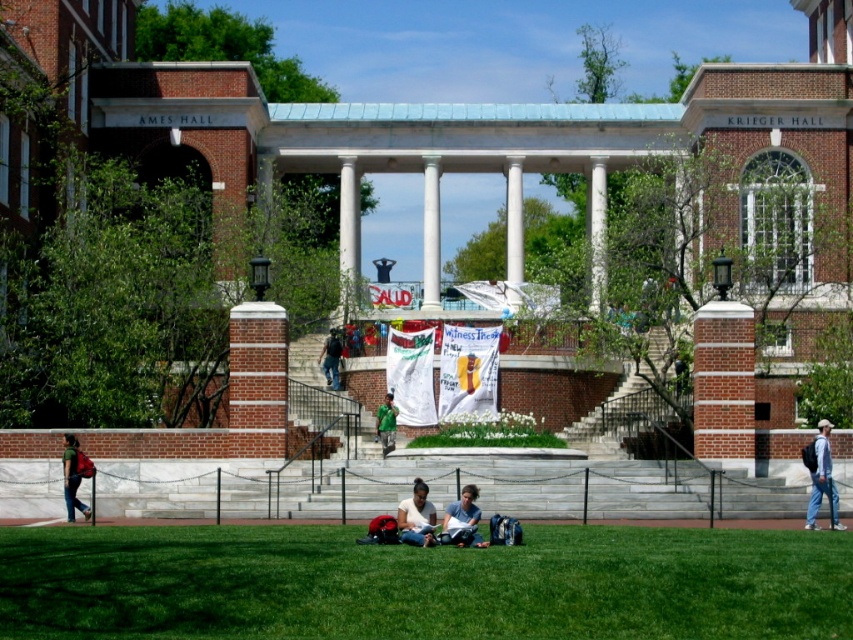
You are a student trying to sit on the wide stone steps in front of the colonnade. You have a matte black backpack at lower center and dark blue jeans at center. Which item takes up more horizontal space?

The matte black backpack at lower center might be wider than dark blue jeans at center, so it could take up more horizontal space.

You are a student carrying a matte black backpack at lower center and a matte blue jeans at center. Which item is taller?

The matte black backpack at lower center is taller than the matte blue jeans at center.

You are a student walking up the stone steps towards the colonnade. You notice a matte red backpack at lower left and a green fabric jacket at center. Which item is closer to the base of the steps?

The matte red backpack at lower left is closer to the base of the steps since it is positioned below the green fabric jacket at center.